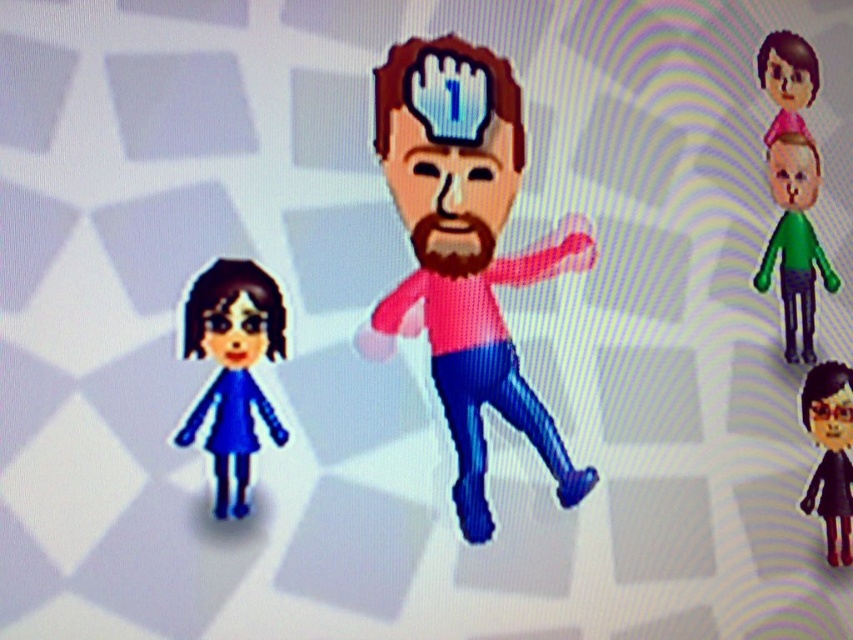
Does blue matte doll at lower left have a greater width compared to black matte doll at lower right?

Correct, the width of blue matte doll at lower left exceeds that of black matte doll at lower right.

Between point (206, 339) and point (838, 470), which one is positioned in front?

Point (206, 339) is more forward.

The image size is (853, 640). I want to click on blue matte doll at lower left, so click(x=231, y=369).

Is pink matte toy at center bigger than green matte toy at upper right?

Correct, pink matte toy at center is larger in size than green matte toy at upper right.

Between point (500, 273) and point (827, 276), which one is positioned in front?

Point (500, 273)

This screenshot has height=640, width=853. Identify the location of pink matte toy at center. (465, 252).

Where is `pink matte toy at center`? The width and height of the screenshot is (853, 640). pink matte toy at center is located at coordinates (465, 252).

Does point (782, 262) lie in front of point (764, 67)?

That is True.

Does green matte toy at upper right have a smaller size compared to pink glossy toy at upper right?

No, green matte toy at upper right is not smaller than pink glossy toy at upper right.

Is point (804, 177) less distant than point (791, 77)?

Yes, it is.

Identify the location of green matte toy at upper right. tap(793, 237).